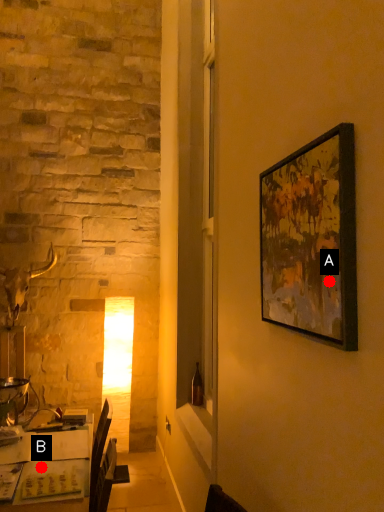
Question: Two points are circled on the image, labeled by A and B beside each circle. Which of the following is the farthest from the observer?

Choices:
 (A) A is further
 (B) B is further

Answer: (B)